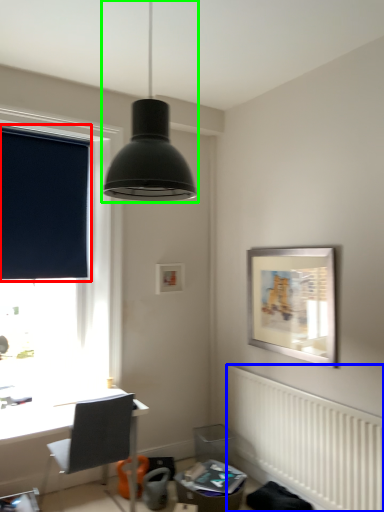
Question: Which object is positioned farthest from window screen (highlighted by a red box)? Select from radiator (highlighted by a blue box) and lamp (highlighted by a green box).

Choices:
 (A) radiator
 (B) lamp

Answer: (B)